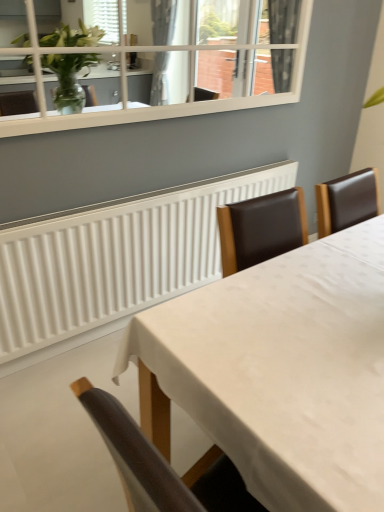
Locate an element on the screen. This screenshot has height=512, width=384. free spot above white fabric-covered table at center (from a real-world perspective) is located at coordinates (304, 289).